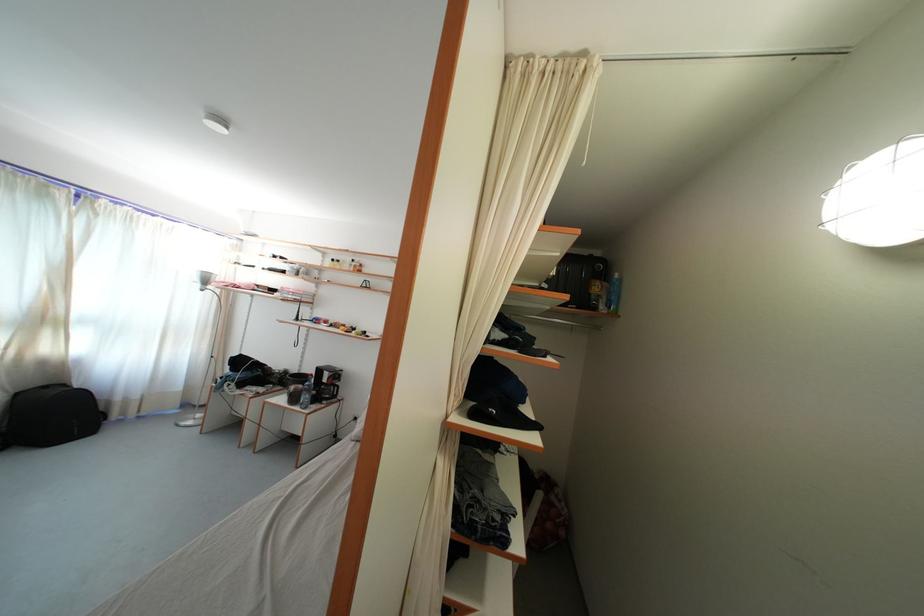
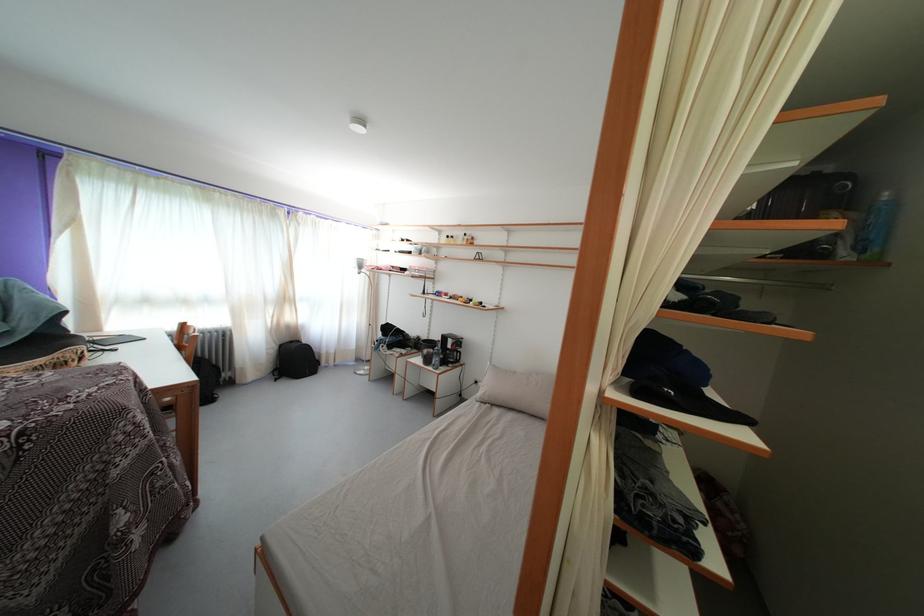
Question: The first image is from the beginning of the video and the second image is from the end. How did the camera likely rotate when shooting the video?

Choices:
 (A) Left
 (B) Right
 (C) Up
 (D) Down

Answer: (A)